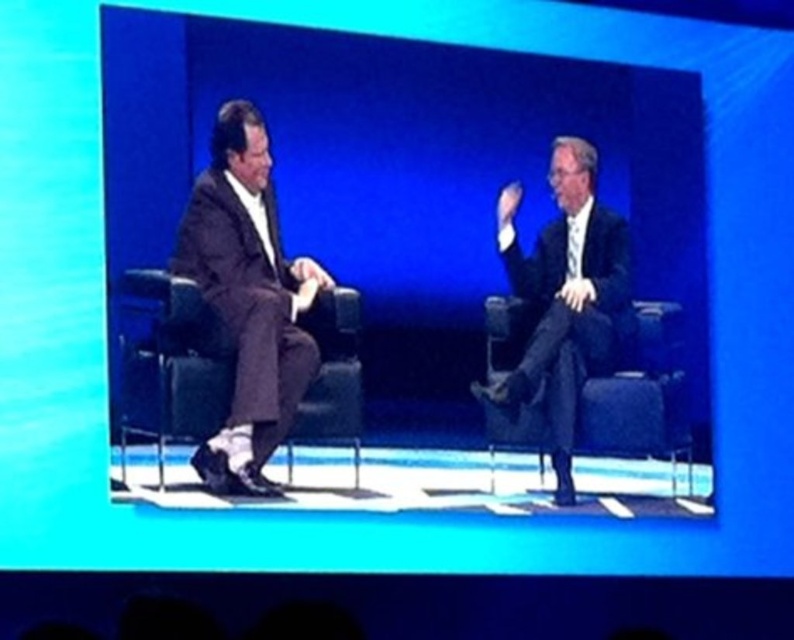
Can you confirm if dark suit at right is positioned to the left of black leather chair at left?

Incorrect, dark suit at right is not on the left side of black leather chair at left.

Locate an element on the screen. dark suit at right is located at coordinates (565, 296).

Does point (569, 480) come behind point (175, 378)?

Yes, it is.

Where is `dark suit at right`? The image size is (794, 640). dark suit at right is located at coordinates (565, 296).

Which is behind, point (297, 314) or point (488, 417)?

The point (488, 417) is more distant.

Is dark brown suit at left above dark blue fabric chair at right?

Yes.

Who is more distant from viewer, (x=230, y=221) or (x=646, y=448)?

Positioned behind is point (x=646, y=448).

Identify the location of dark brown suit at left. This screenshot has width=794, height=640. (249, 300).

Is point (249, 484) positioned in front of point (588, 340)?

Yes, it is.

Does point (282, 288) come farther from viewer compared to point (550, 381)?

No, (282, 288) is in front of (550, 381).

Where is `dark brown suit at left`? This screenshot has height=640, width=794. dark brown suit at left is located at coordinates (249, 300).